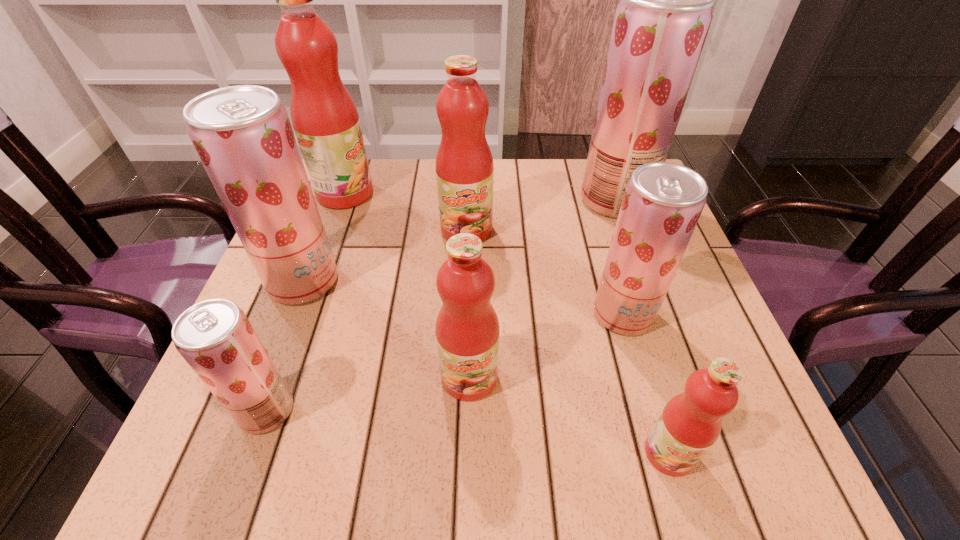
I want to click on object present at the near right corner, so click(690, 423).

Locate an element on the screen. vacant space at the far edge of the desktop is located at coordinates (377, 179).

Identify the location of blank space at the left edge of the desktop. The height and width of the screenshot is (540, 960). (347, 265).

Locate an element on the screen. Image resolution: width=960 pixels, height=540 pixels. vacant space at the right edge of the desktop is located at coordinates (603, 226).

In the image, there is a desktop. At what (x,y) coordinates should I click in order to perform the action: click on vacant space at the near left corner. Please return your answer as a coordinate pair (x, y). The width and height of the screenshot is (960, 540). Looking at the image, I should click on (270, 454).

Find the location of `vacant area that lies between the nearest strawberry fruit juice and the second smallest pink fruit juice`. vacant area that lies between the nearest strawberry fruit juice and the second smallest pink fruit juice is located at coordinates (368, 394).

This screenshot has width=960, height=540. Find the location of `blank region between the second smallest strawberry fruit juice and the nearest pink fruit juice`. blank region between the second smallest strawberry fruit juice and the nearest pink fruit juice is located at coordinates click(646, 383).

I want to click on vacant area between the third biggest strawberry fruit juice and the farthest pink fruit juice, so click(x=484, y=254).

The width and height of the screenshot is (960, 540). I want to click on vacant area that lies between the third smallest pink fruit juice and the third biggest strawberry fruit juice, so click(x=544, y=272).

Locate an element on the screen. This screenshot has width=960, height=540. free spot between the smallest pink fruit juice and the farthest pink fruit juice is located at coordinates (507, 323).